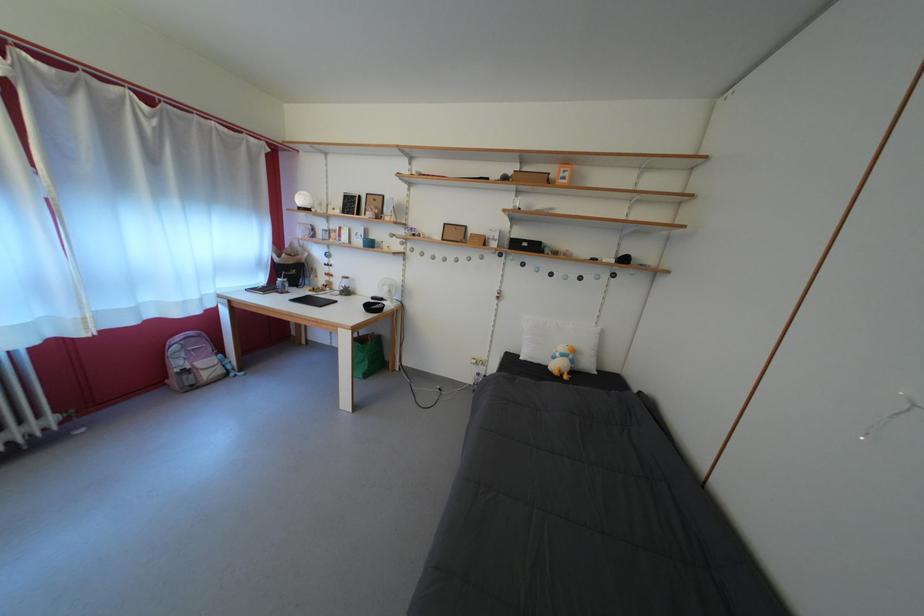
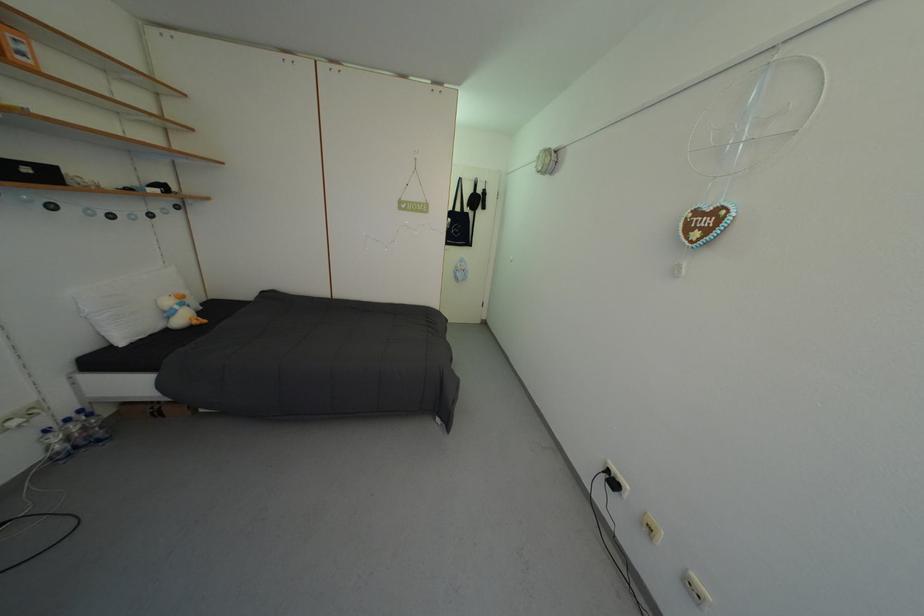
Locate, in the second image, the point that corresponds to [487,379] in the first image.

(55, 437)